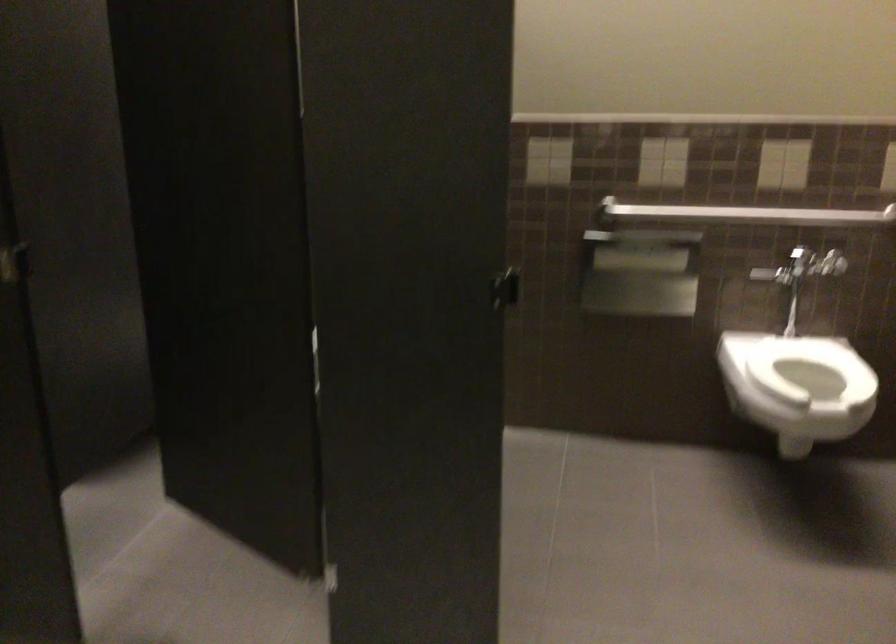
What do you see at coordinates (800, 261) in the screenshot?
I see `a toilet flush handle` at bounding box center [800, 261].